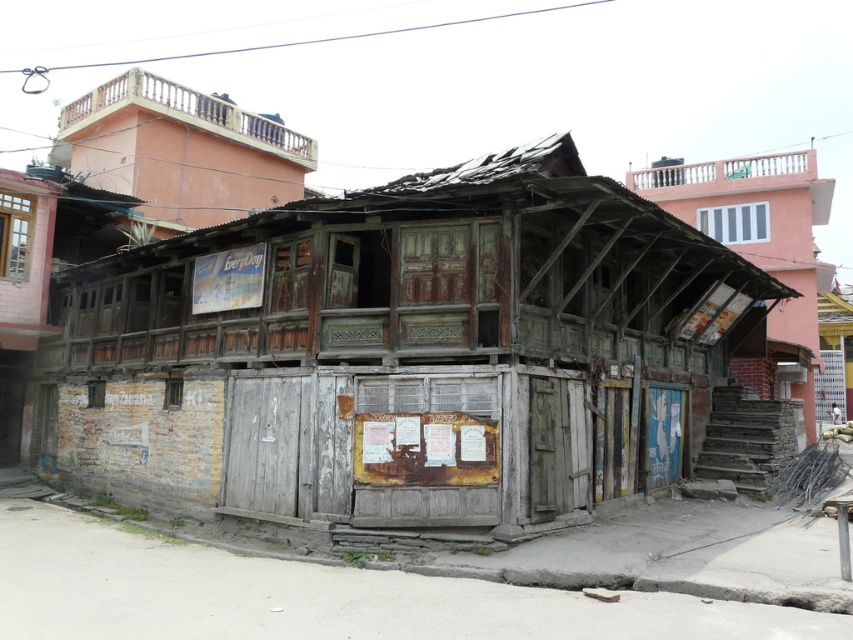
Is weathered wood hut at center closer to the viewer compared to wooden shack at upper right?

Yes, weathered wood hut at center is closer to the viewer.

Which is behind, point (433, 484) or point (784, 337)?

Positioned behind is point (784, 337).

Which is behind, point (404, 221) or point (677, 176)?

Positioned behind is point (677, 176).

The width and height of the screenshot is (853, 640). What are the coordinates of `weathered wood hut at center` in the screenshot? It's located at (402, 353).

Which is more to the right, weathered wood hut at center or wooden balcony at upper left?

From the viewer's perspective, weathered wood hut at center appears more on the right side.

Consider the image. Can you confirm if weathered wood hut at center is positioned above wooden balcony at upper left?

Actually, weathered wood hut at center is below wooden balcony at upper left.

Identify the location of weathered wood hut at center. (402, 353).

Can you confirm if wooden balcony at upper left is wider than wooden shack at upper right?

Incorrect, wooden balcony at upper left's width does not surpass wooden shack at upper right's.

Does point (221, 163) lie behind point (721, 227)?

No, (221, 163) is in front of (721, 227).

What do you see at coordinates (180, 150) in the screenshot? I see `wooden balcony at upper left` at bounding box center [180, 150].

Locate an element on the screen. This screenshot has height=640, width=853. wooden balcony at upper left is located at coordinates (180, 150).